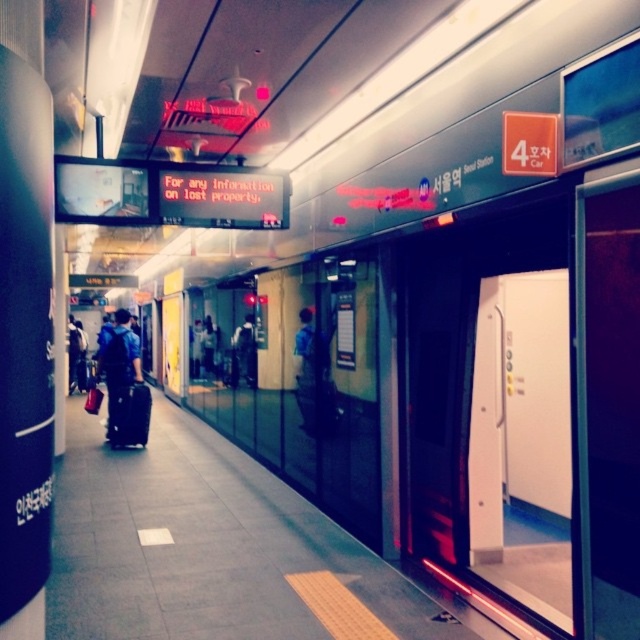
Between blue fabric backpack at center and dark blue backpack at center, which one appears on the left side from the viewer's perspective?

From the viewer's perspective, blue fabric backpack at center appears more on the left side.

From the picture: Can you confirm if blue fabric backpack at center is positioned to the left of dark blue backpack at center?

Indeed, blue fabric backpack at center is positioned on the left side of dark blue backpack at center.

I want to click on blue fabric backpack at center, so click(118, 365).

How much distance is there between black fabric suitcase at center and dark blue backpack at center?

The distance of black fabric suitcase at center from dark blue backpack at center is 6.16 feet.

Between black fabric suitcase at center and dark blue backpack at center, which one appears on the left side from the viewer's perspective?

From the viewer's perspective, black fabric suitcase at center appears more on the left side.

Who is more distant from viewer, (x=141, y=387) or (x=253, y=358)?

Positioned behind is point (x=141, y=387).

Identify the location of black fabric suitcase at center. (129, 413).

Image resolution: width=640 pixels, height=640 pixels. What do you see at coordinates (118, 365) in the screenshot? I see `blue fabric backpack at center` at bounding box center [118, 365].

In the scene shown: Does blue fabric backpack at center have a greater height compared to black fabric suitcase at center?

Yes.

Between point (131, 337) and point (124, 422), which one is positioned in front?

Point (124, 422) is more forward.

This screenshot has height=640, width=640. Identify the location of blue fabric backpack at center. (118, 365).